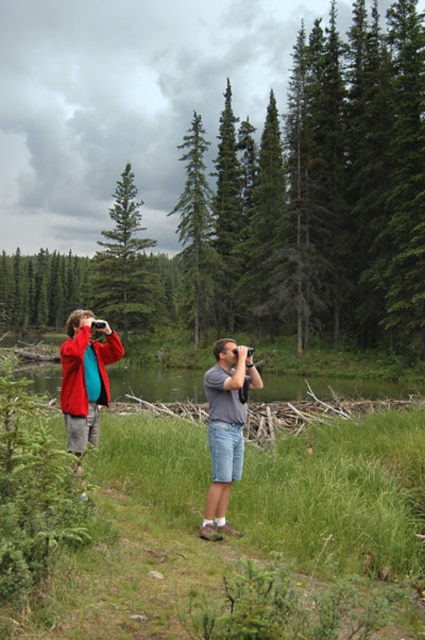
You are planning to take a photo of the green matte tree at upper center and the denim shorts at center. Which object should you focus on first if you want to ensure both are in sharp focus?

The green matte tree at upper center is wider than the denim shorts at center, so you should focus on the green matte tree at upper center first to ensure both are in sharp focus.

You are a hiker who wants to take a photo of the green matte tree at upper center. You are standing at point (124, 266). Is the green matte tree at upper center directly in front of you?

The green matte tree at upper center is located at point (124, 266), which is where you are standing, so you cannot take a photo of it from that position as you are already at that location.

You are a hiker who wants to take a photo of the green matte tree at upper center and the green matte tree at center. Which tree should you focus on first if you want to capture both in the same frame?

The green matte tree at upper center is below the green matte tree at center, so you should focus on the green matte tree at center first to ensure both are in the frame.